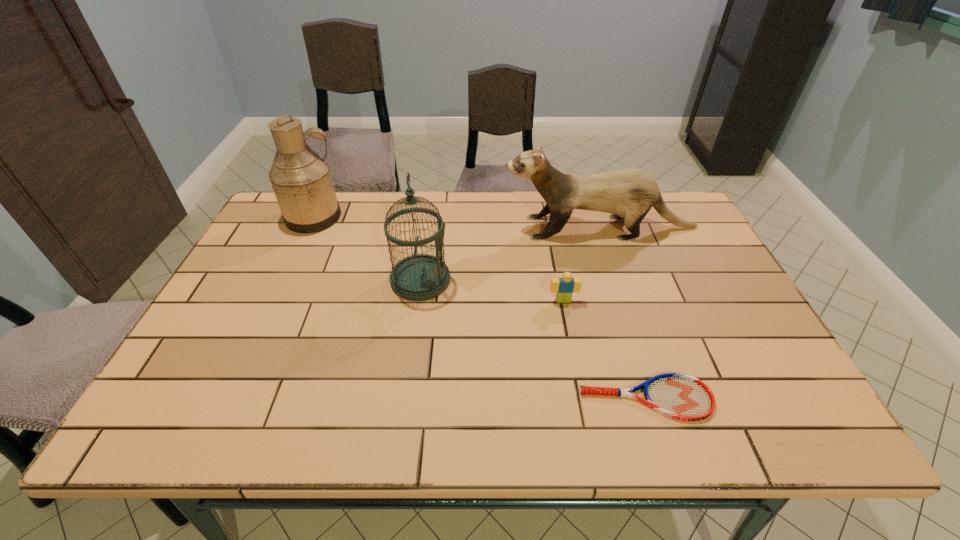
Identify the location of vacant space at the far edge of the desktop. (379, 198).

Identify the location of free space at the near edge of the desktop. (248, 405).

This screenshot has height=540, width=960. I want to click on vacant space at the left edge of the desktop, so click(x=264, y=258).

Identify the location of free space at the right edge of the desktop. The width and height of the screenshot is (960, 540). 730,352.

This screenshot has height=540, width=960. Find the location of `free space at the near right corner of the desktop`. free space at the near right corner of the desktop is located at coordinates (788, 416).

Find the location of a particular element. This screenshot has width=960, height=540. unoccupied area between the Lego and the birdcage is located at coordinates (492, 290).

Identify the location of vacant space that's between the shortest object and the second shortest object. This screenshot has width=960, height=540. (605, 349).

The height and width of the screenshot is (540, 960). Identify the location of vacant region between the ferret and the pitcher. (457, 222).

The height and width of the screenshot is (540, 960). I want to click on empty space that is in between the birdcage and the third shortest object, so coord(510,254).

You are a GUI agent. You are given a task and a screenshot of the screen. Output one action in this format:
    pyautogui.click(x=<x>, y=<y>)
    Task: Click on the free space between the pitcher and the shortest object
    This screenshot has width=960, height=540.
    Given the screenshot: What is the action you would take?
    pyautogui.click(x=480, y=308)